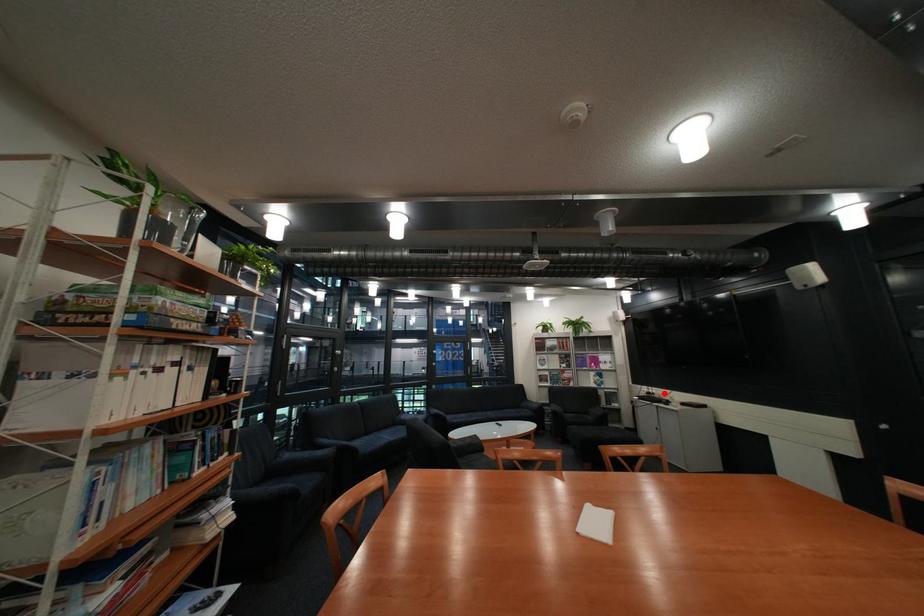
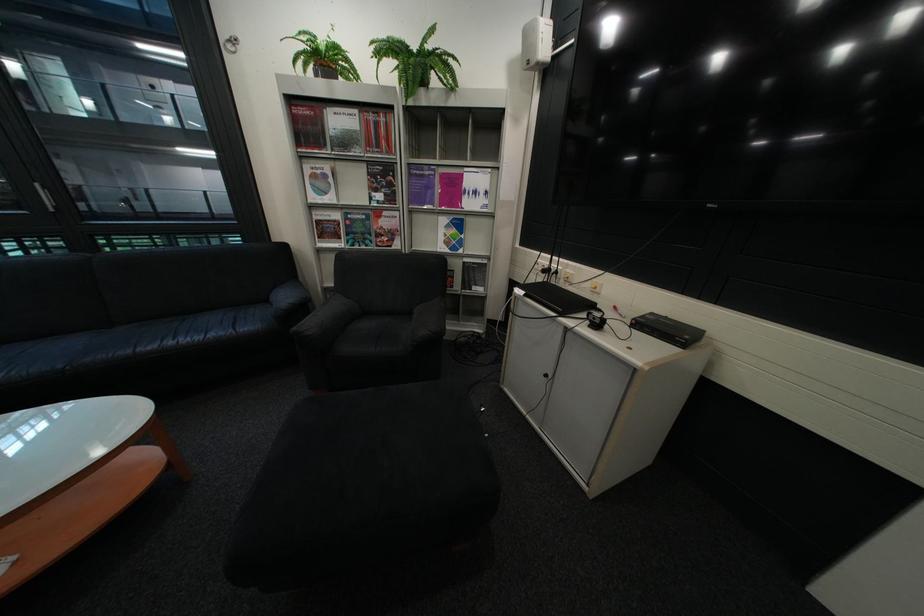
Question: I am providing you with two images of the same scene from different viewpoints. A red point is shown in image1. For the corresponding object point in image2, is it positioned nearer or farther from the camera?

Choices:
 (A) Nearer
 (B) Farther

Answer: (A)